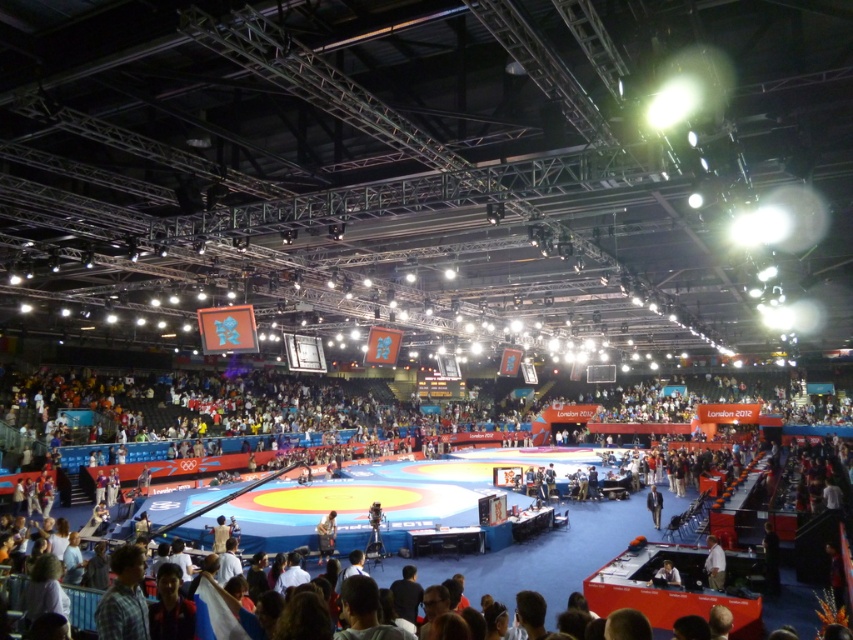
Is white shirt at lower right above blue fabric jacket at center?

Yes, white shirt at lower right is above blue fabric jacket at center.

Which of these two, white shirt at lower right or blue fabric jacket at center, stands taller?

blue fabric jacket at center is taller.

Which is in front, point (711, 580) or point (659, 497)?

Point (711, 580) is more forward.

Identify the location of white shirt at lower right. Image resolution: width=853 pixels, height=640 pixels. (714, 563).

How far apart are blue fabric mat at center and white shirt at lower right?

The distance of blue fabric mat at center from white shirt at lower right is 19.35 meters.

Who is shorter, blue fabric mat at center or white shirt at lower right?

With less height is white shirt at lower right.

This screenshot has width=853, height=640. What do you see at coordinates (699, 477) in the screenshot?
I see `blue fabric mat at center` at bounding box center [699, 477].

The width and height of the screenshot is (853, 640). What are the coordinates of `blue fabric mat at center` in the screenshot? It's located at (699, 477).

Does blue fabric mat at center come in front of blue fabric jacket at center?

Yes.

Between point (322, 509) and point (657, 500), which one is positioned in front?

Point (657, 500)

What are the coordinates of `blue fabric mat at center` in the screenshot? It's located at (699, 477).